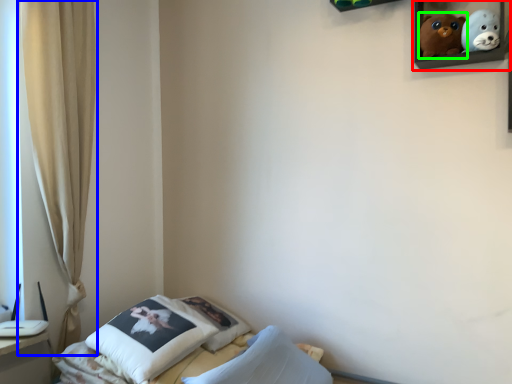
Question: Which object is the farthest from picture frame (highlighted by a red box)? Choose among these: curtain (highlighted by a blue box) or toy (highlighted by a green box).

Choices:
 (A) curtain
 (B) toy

Answer: (A)